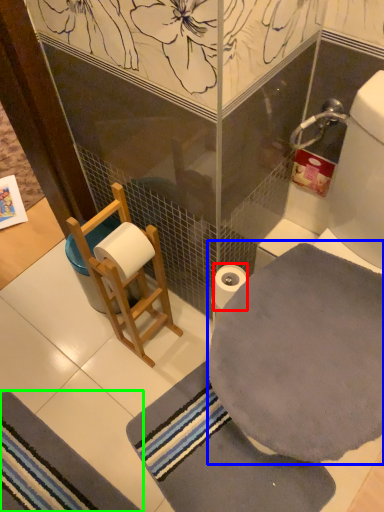
Question: Estimate the real-world distances between objects in this image. Which object is closer to toilet paper (highlighted by a red box), bath towel (highlighted by a blue box) or bath mat (highlighted by a green box)?

Choices:
 (A) bath towel
 (B) bath mat

Answer: (A)